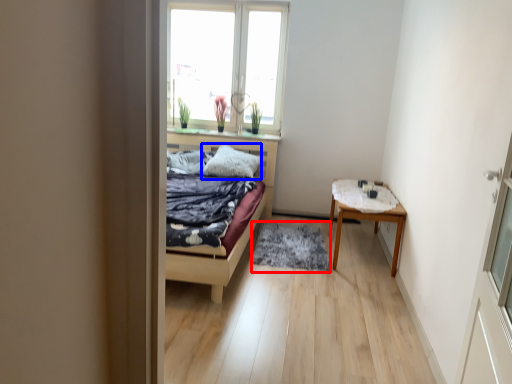
Question: Which object appears farthest to the camera in this image, mat (highlighted by a red box) or pillow (highlighted by a blue box)?

Choices:
 (A) mat
 (B) pillow

Answer: (B)